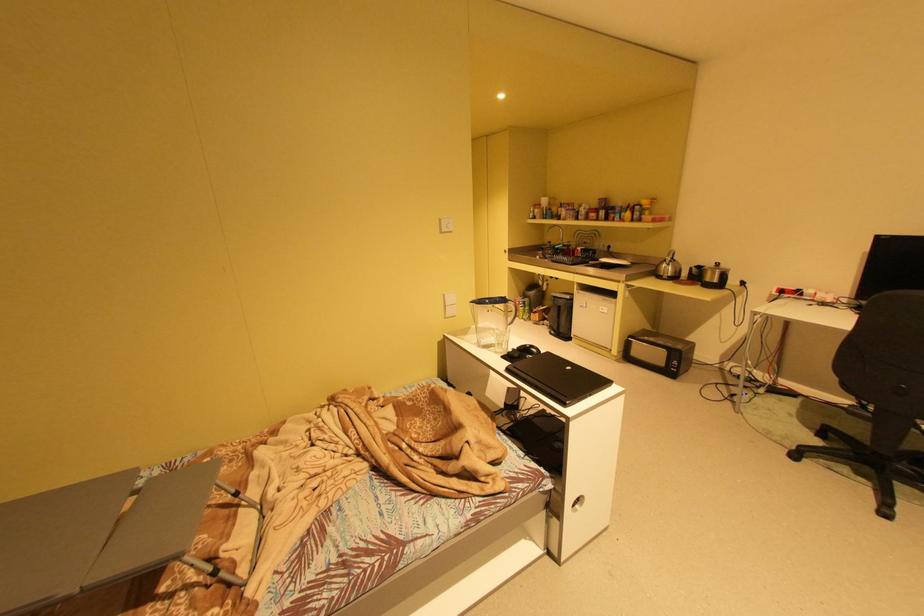
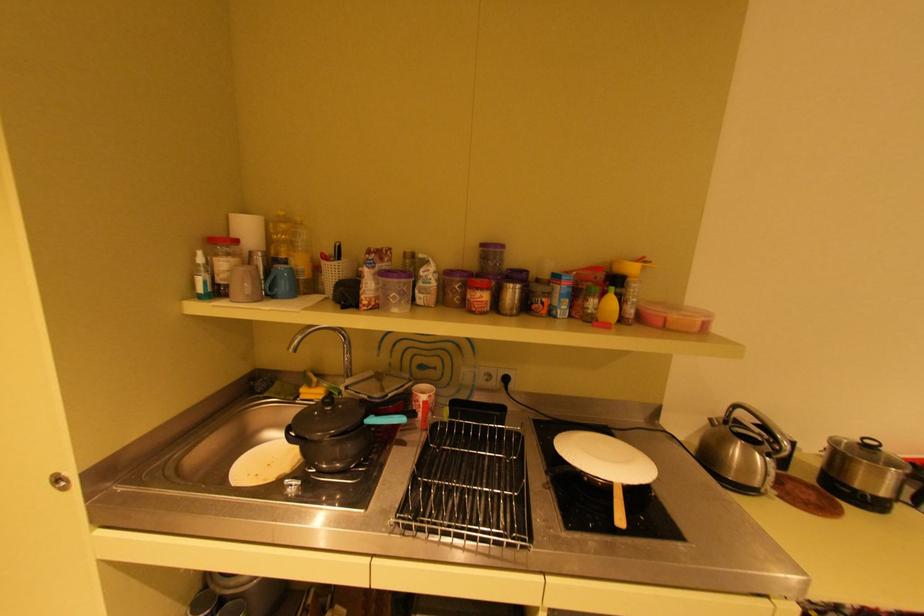
Where in the second image is the point corresponding to (x=539, y=219) from the first image?

(208, 297)